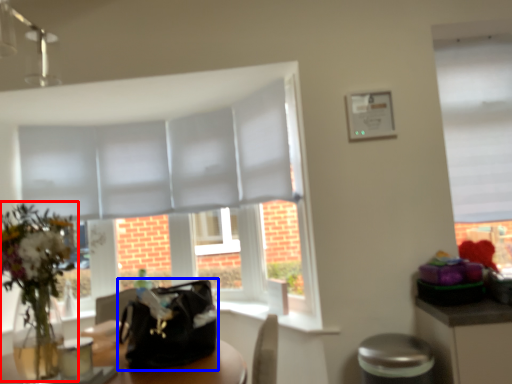
Question: Among these objects, which one is farthest to the camera, floral arrangement (highlighted by a red box) or handbag (highlighted by a blue box)?

Choices:
 (A) floral arrangement
 (B) handbag

Answer: (B)